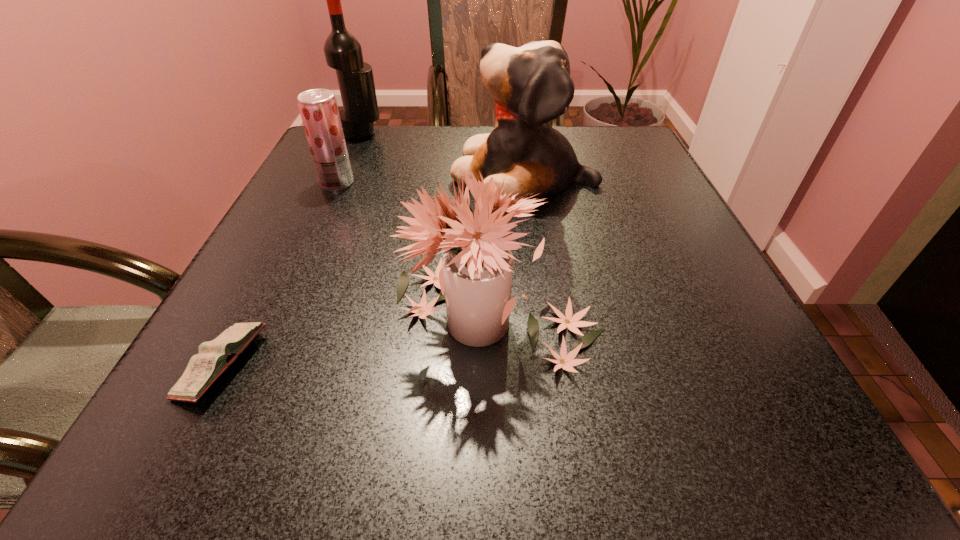
Locate an element on the screen. object that is at the far left corner is located at coordinates (343, 52).

Locate an element on the screen. The width and height of the screenshot is (960, 540). object that is at the near left corner is located at coordinates (215, 356).

This screenshot has width=960, height=540. I want to click on object located in the far right corner section of the desktop, so click(x=531, y=85).

The height and width of the screenshot is (540, 960). In the image, there is a desktop. Find the location of `vacant space at the left edge`. vacant space at the left edge is located at coordinates (243, 267).

The image size is (960, 540). What are the coordinates of `free space at the right edge of the desktop` in the screenshot? It's located at (709, 305).

This screenshot has width=960, height=540. In the image, there is a desktop. What are the coordinates of `vacant space at the far right corner` in the screenshot? It's located at (608, 155).

Where is `free space at the near right corner of the desktop`? Image resolution: width=960 pixels, height=540 pixels. free space at the near right corner of the desktop is located at coordinates (694, 427).

Identify the location of free space between the shortest object and the bouquet. (360, 340).

Identify the location of vacant area between the tallest object and the puppy. (444, 154).

Identify the location of free spot between the tallest object and the fourth tallest object. (349, 158).